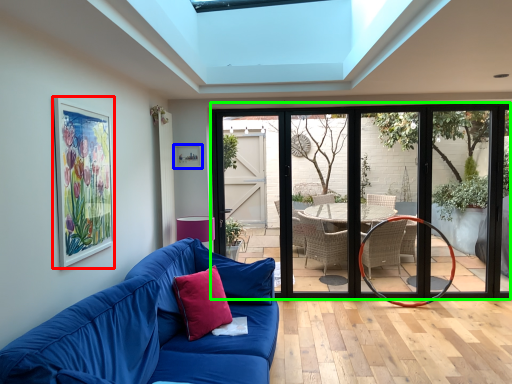
Question: Which is nearer to the picture frame (highlighted by a red box)? picture frame (highlighted by a blue box) or door (highlighted by a green box).

Choices:
 (A) picture frame
 (B) door

Answer: (A)